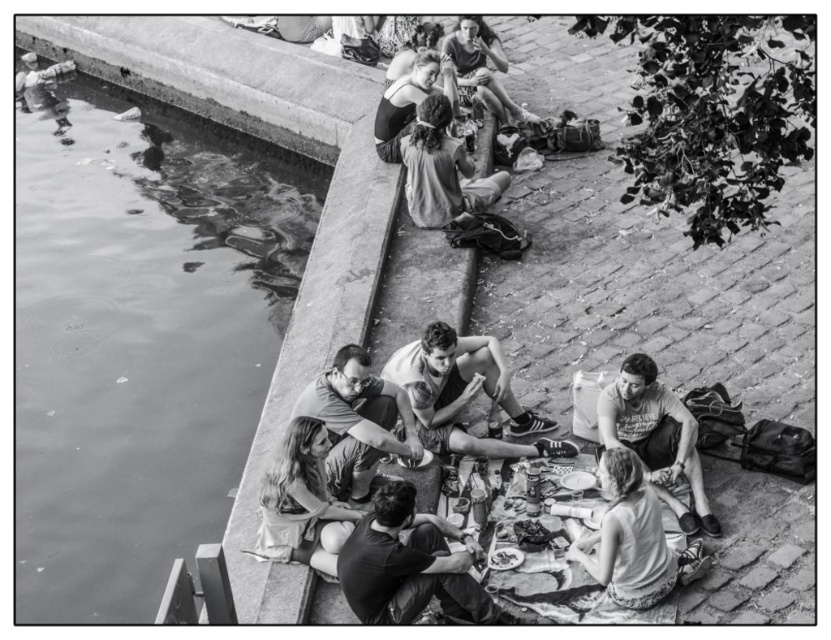
Can you confirm if smooth white shirt at lower right is positioned to the right of rough fabric shirt at center?

Indeed, smooth white shirt at lower right is positioned on the right side of rough fabric shirt at center.

Does point (627, 452) lie behind point (428, 189)?

No, it is in front of (428, 189).

The image size is (831, 640). Find the location of `smooth white shirt at lower right`. smooth white shirt at lower right is located at coordinates (628, 538).

The image size is (831, 640). Find the location of `smooth white shirt at lower right`. smooth white shirt at lower right is located at coordinates [x=628, y=538].

Does dark gray fabric at lower center come in front of metallic silver camera at upper left?

Yes, it is.

Can you confirm if dark gray fabric at lower center is positioned to the left of metallic silver camera at upper left?

No, dark gray fabric at lower center is not to the left of metallic silver camera at upper left.

The image size is (831, 640). In order to click on dark gray fabric at lower center in this screenshot , I will do `click(411, 564)`.

Which is above, smooth white tank top at center or smooth gray shirt at center?

smooth white tank top at center is higher up.

Which is in front, point (416, 432) or point (333, 428)?

Point (333, 428)

Locate an element on the screen. The width and height of the screenshot is (831, 640). smooth white tank top at center is located at coordinates (465, 394).